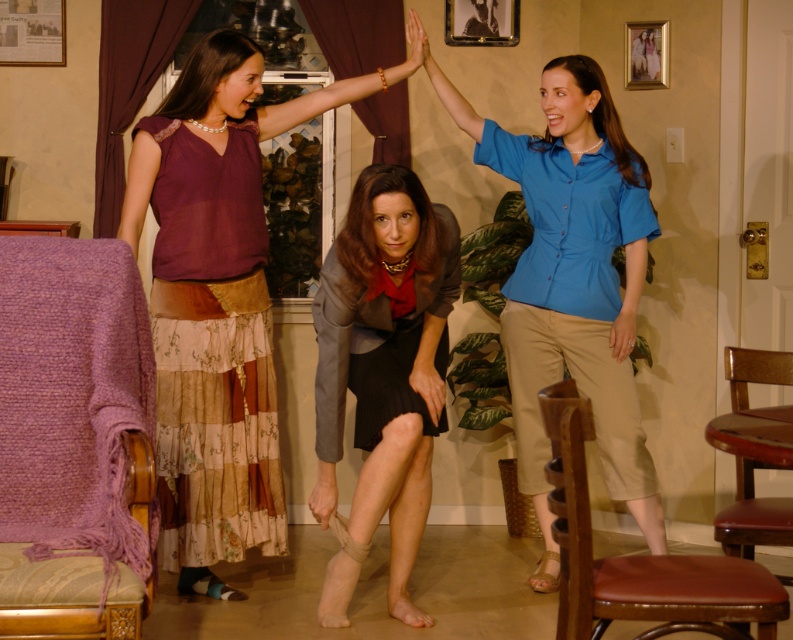
Which is more to the left, black satin dress at center or wooden chair at lower right?

black satin dress at center is more to the left.

Can you confirm if black satin dress at center is positioned above wooden chair at lower right?

Indeed, black satin dress at center is positioned over wooden chair at lower right.

Image resolution: width=793 pixels, height=640 pixels. In order to click on black satin dress at center in this screenshot , I will do (x=399, y=340).

Does blue button-up shirt at upper right have a greater height compared to matte blue shirt at right?

Indeed, blue button-up shirt at upper right has a greater height compared to matte blue shirt at right.

Does blue button-up shirt at upper right have a lesser height compared to matte blue shirt at right?

In fact, blue button-up shirt at upper right may be taller than matte blue shirt at right.

Where is `blue button-up shirt at upper right`? The height and width of the screenshot is (640, 793). blue button-up shirt at upper right is located at coordinates (573, 280).

Who is positioned more to the left, matte purple blouse at left or matte purple blouse at upper left?

Positioned to the left is matte purple blouse at upper left.

Can you confirm if matte purple blouse at left is positioned above matte purple blouse at upper left?

Incorrect, matte purple blouse at left is not positioned above matte purple blouse at upper left.

The image size is (793, 640). What do you see at coordinates (213, 349) in the screenshot?
I see `matte purple blouse at left` at bounding box center [213, 349].

Locate an element on the screen. matte purple blouse at left is located at coordinates (213, 349).